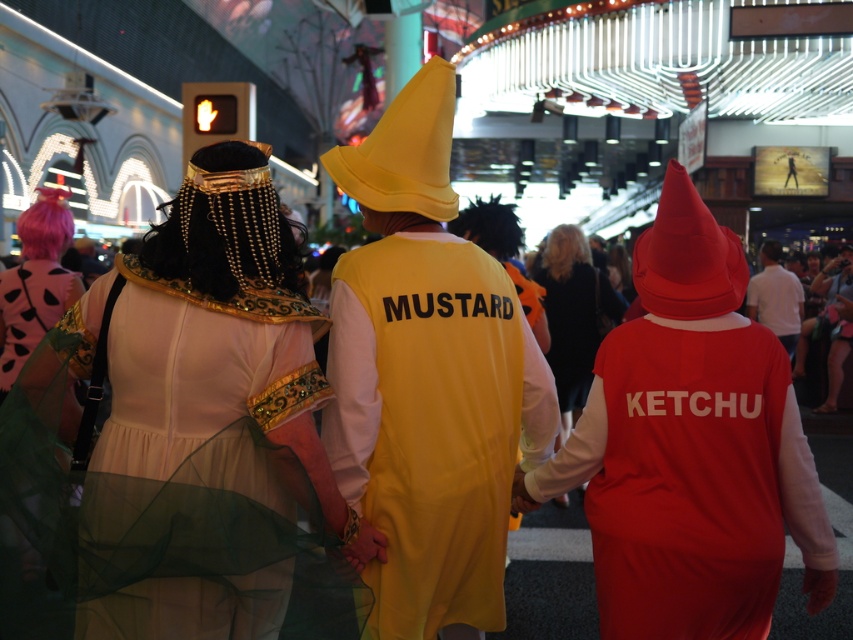
You are a photographer at the event and want to take a photo that includes both the yellow matte dress at center and the matte red costume at right. Which of the two costumes is closer to you, the photographer?

The yellow matte dress at center is closer to you than the matte red costume at right.

You are a photographer at the event and want to capture a photo of the matte gold dress at center. Where should you aim your camera to ensure the dress is in the frame?

You should aim your camera at point (207, 385) to capture the matte gold dress at center, as that is its exact position.